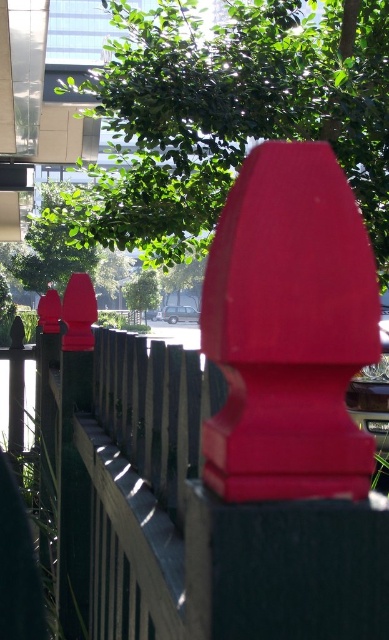
From the picture: You are taking a photo of the wooden fence with red decorative finials. You notice two points on the fence labeled as point (x=148, y=205) and point (x=236, y=202). Which point is closer to your camera lens?

Point (x=148, y=205) is further to the camera than point (x=236, y=202), so point (x=148, y=205) is closer to the camera lens.

You are a painter standing in front of the matte wood fence at center and the matte plastic fence post at center. You want to paint the closest object first. Which object should you paint first?

The matte wood fence at center is closer to you than the matte plastic fence post at center, so you should paint the matte wood fence at center first.